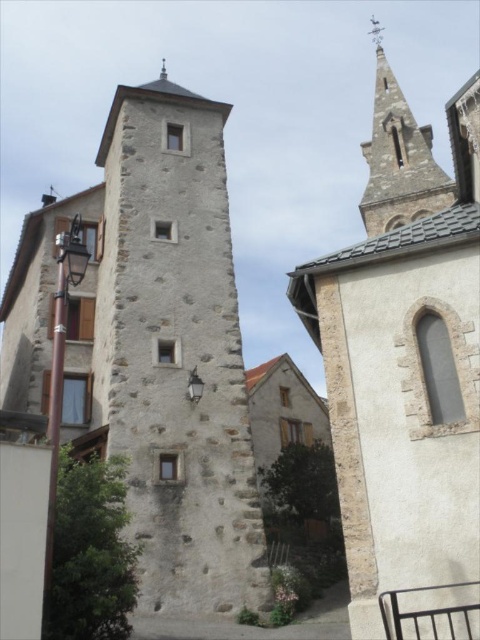
Question: Which object is closer to the camera taking this photo?

Choices:
 (A) stone tower at center
 (B) stone steeple at upper right
 (C) smooth stone steeple at upper right

Answer: (B)

Question: Is stone tower at center smaller than smooth stone steeple at upper right?

Choices:
 (A) no
 (B) yes

Answer: (A)

Question: Estimate the real-world distances between objects in this image. Which object is farther from the smooth stone steeple at upper right?

Choices:
 (A) stone steeple at upper right
 (B) stone tower at center

Answer: (B)

Question: Is stone tower at center closer to camera compared to smooth stone steeple at upper right?

Choices:
 (A) no
 (B) yes

Answer: (B)

Question: Can you confirm if stone steeple at upper right is bigger than stone tower at center?

Choices:
 (A) yes
 (B) no

Answer: (A)

Question: Which is farther from the smooth stone steeple at upper right?

Choices:
 (A) stone tower at center
 (B) stone steeple at upper right

Answer: (A)